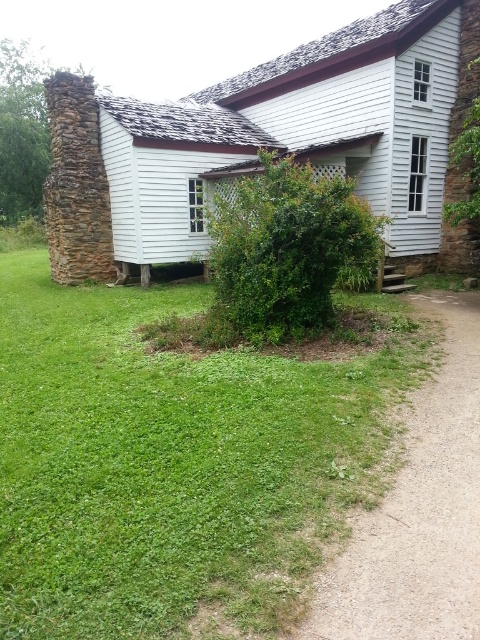
Is point (430, 211) more distant than point (385, 588)?

Yes, it is behind point (385, 588).

Is the position of white wooden cottage at left more distant than that of dirt/gravel path at lower right?

Yes, white wooden cottage at left is behind dirt/gravel path at lower right.

Where is `white wooden cottage at left`? Image resolution: width=480 pixels, height=640 pixels. white wooden cottage at left is located at coordinates (267, 140).

I want to click on white wooden cottage at left, so click(x=267, y=140).

Is point (17, 474) positioned behind point (182, 195)?

No, (17, 474) is closer to viewer.

Does green grass at lower left lie behind white wooden cottage at left?

No, it is in front of white wooden cottage at left.

Is point (166, 467) positioned after point (339, 156)?

No, (166, 467) is in front of (339, 156).

Identify the location of green grass at lower left. (172, 460).

Who is positioned more to the left, green grass at lower left or dirt/gravel path at lower right?

From the viewer's perspective, green grass at lower left appears more on the left side.

Is green grass at lower left below dirt/gravel path at lower right?

Actually, green grass at lower left is above dirt/gravel path at lower right.

Is point (16, 522) positioned before point (445, 428)?

Yes, point (16, 522) is in front of point (445, 428).

You are a GUI agent. You are given a task and a screenshot of the screen. Output one action in this format:
    pyautogui.click(x=<x>, y=<y>)
    Task: Click on the green grass at lower left
    This screenshot has width=480, height=640.
    Given the screenshot: What is the action you would take?
    pyautogui.click(x=172, y=460)